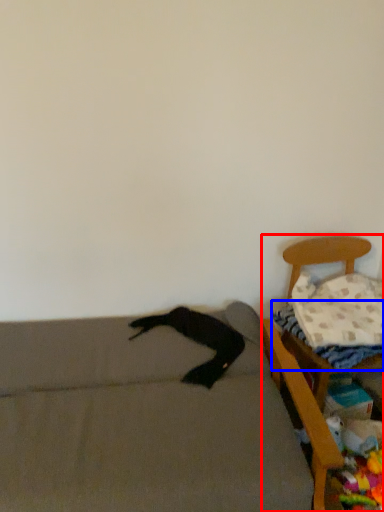
Question: Which object appears farthest to the camera in this image, furniture (highlighted by a red box) or sheet (highlighted by a blue box)?

Choices:
 (A) furniture
 (B) sheet

Answer: (B)